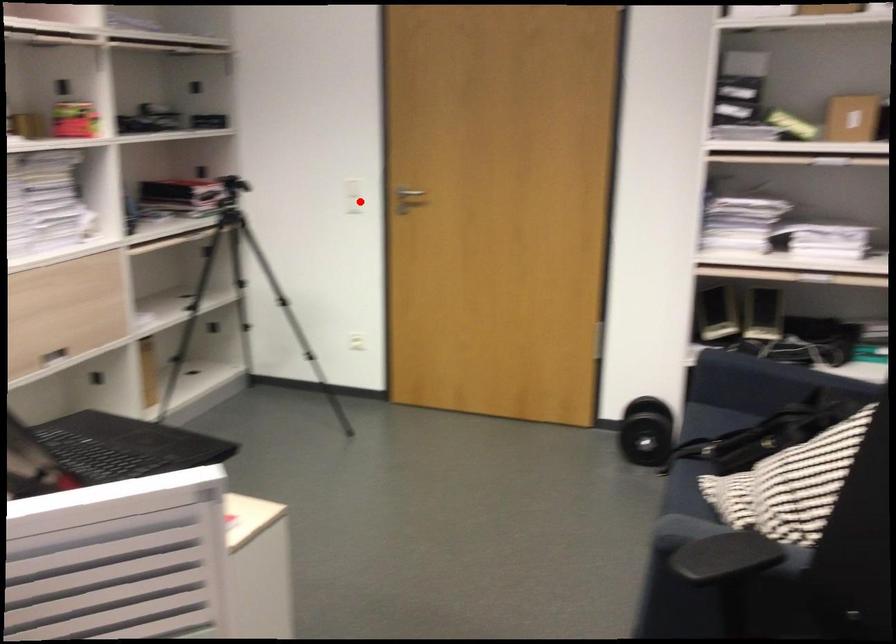
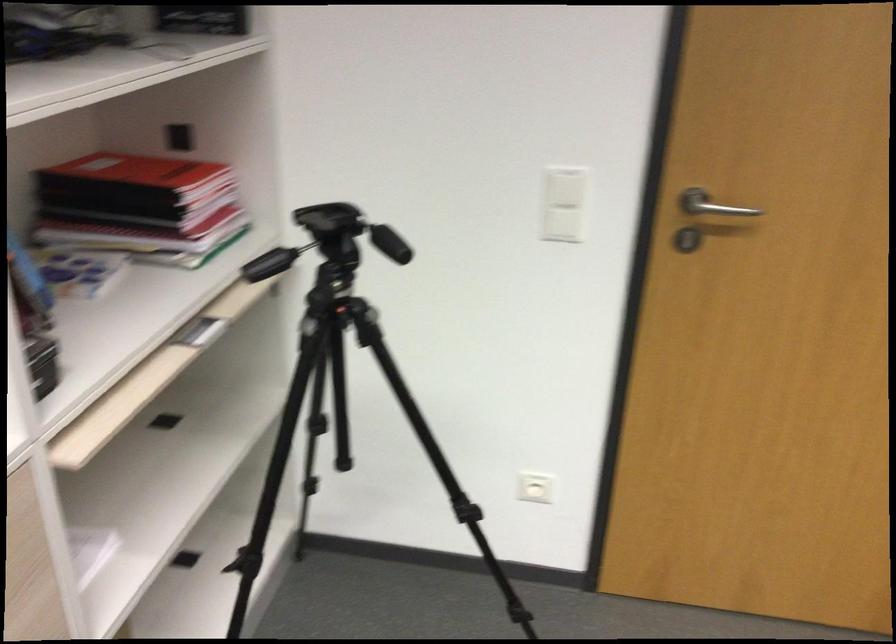
In the second image, find the point that corresponds to the highlighted location in the first image.

(563, 225)